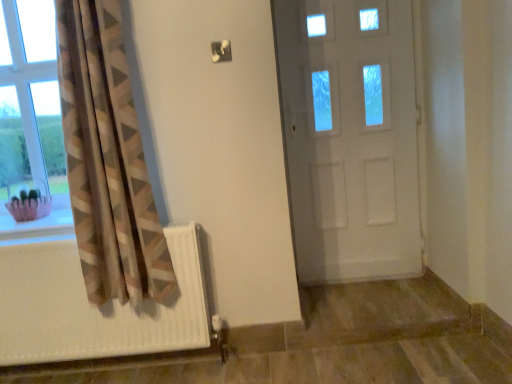
Question: Should I look upward or downward to see clear glass window at left?

Choices:
 (A) down
 (B) up

Answer: (B)

Question: From the image's perspective, is pink fabric basket at lower left beneath clear glass window at left?

Choices:
 (A) no
 (B) yes

Answer: (B)

Question: Is pink fabric basket at lower left not inside clear glass window at left?

Choices:
 (A) yes
 (B) no

Answer: (A)

Question: From a real-world perspective, is pink fabric basket at lower left below clear glass window at left?

Choices:
 (A) yes
 (B) no

Answer: (A)

Question: Does pink fabric basket at lower left have a lesser height compared to clear glass window at left?

Choices:
 (A) yes
 (B) no

Answer: (A)

Question: Does pink fabric basket at lower left have a greater height compared to clear glass window at left?

Choices:
 (A) no
 (B) yes

Answer: (A)

Question: Considering the relative positions of pink fabric basket at lower left and clear glass window at left in the image provided, is pink fabric basket at lower left behind clear glass window at left?

Choices:
 (A) yes
 (B) no

Answer: (B)

Question: Is white glossy door at center positioned far away from pink fabric basket at lower left?

Choices:
 (A) no
 (B) yes

Answer: (B)

Question: Can you confirm if white glossy door at center is wider than pink fabric basket at lower left?

Choices:
 (A) no
 (B) yes

Answer: (A)

Question: Is white glossy door at center smaller than pink fabric basket at lower left?

Choices:
 (A) yes
 (B) no

Answer: (B)

Question: Could you tell me if white glossy door at center is turned towards pink fabric basket at lower left?

Choices:
 (A) yes
 (B) no

Answer: (B)

Question: Is white glossy door at center closer to camera compared to pink fabric basket at lower left?

Choices:
 (A) no
 (B) yes

Answer: (A)

Question: Can you confirm if white glossy door at center is positioned to the left of pink fabric basket at lower left?

Choices:
 (A) yes
 (B) no

Answer: (B)

Question: Can you confirm if clear glass window at left is wider than white glossy door at center?

Choices:
 (A) no
 (B) yes

Answer: (B)